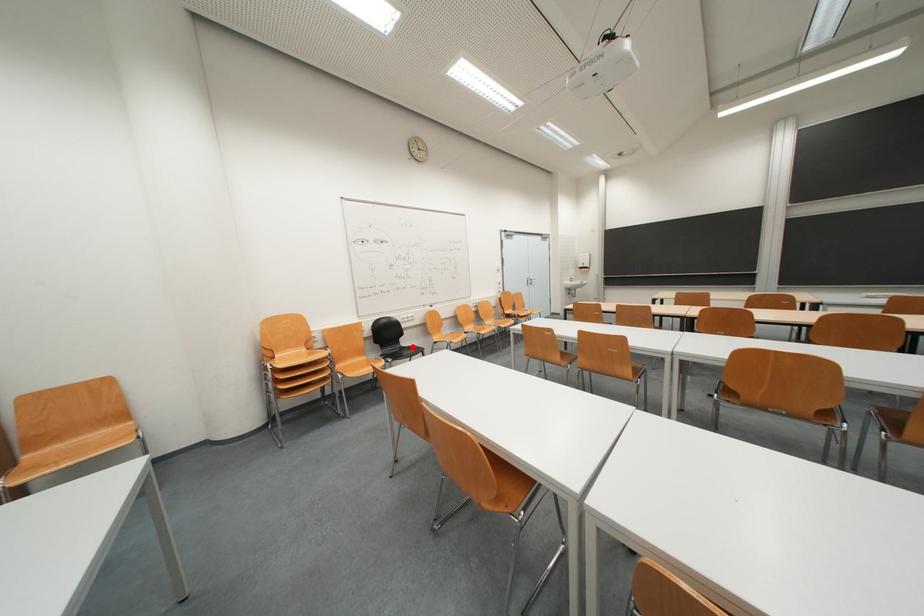
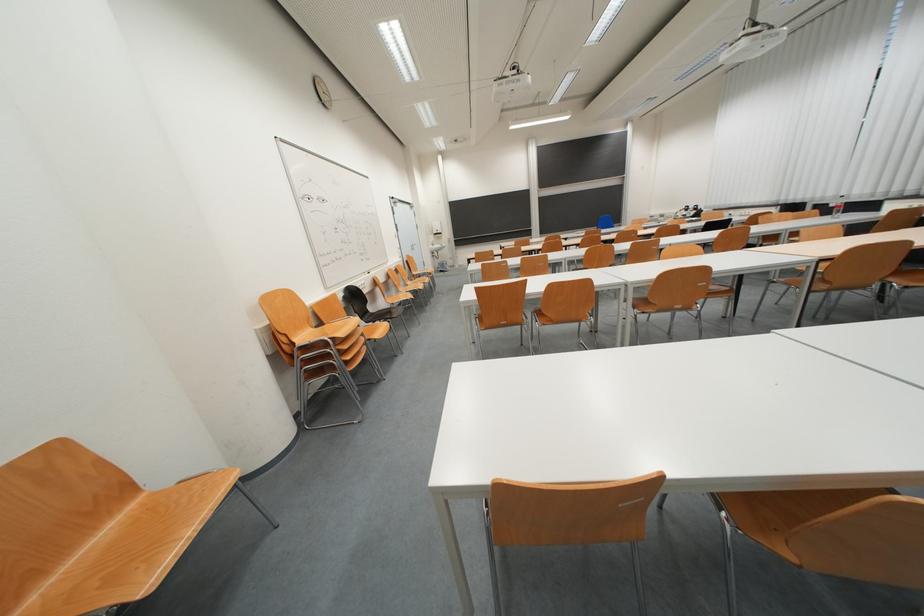
Locate, in the second image, the point that corresponds to the highlighted location in the first image.

(379, 313)